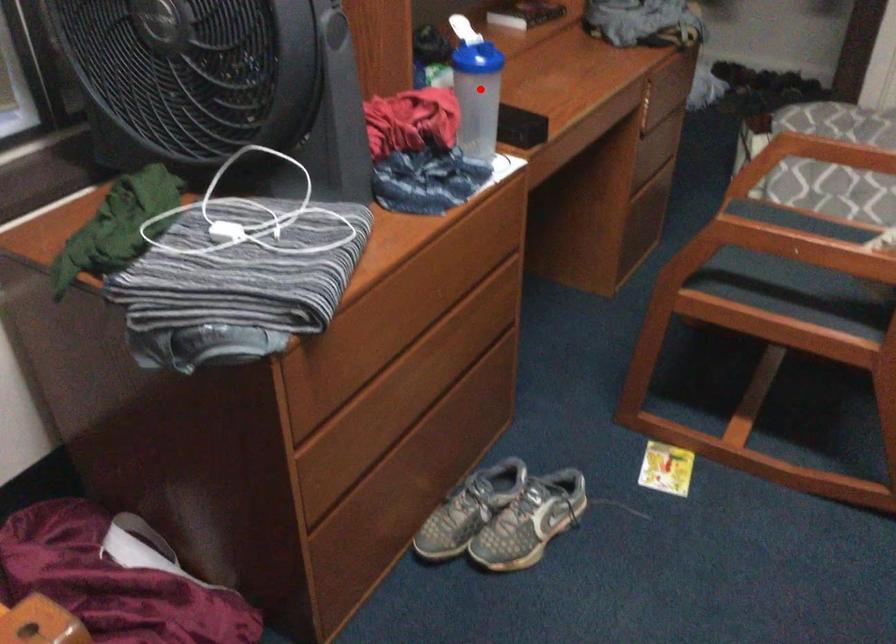
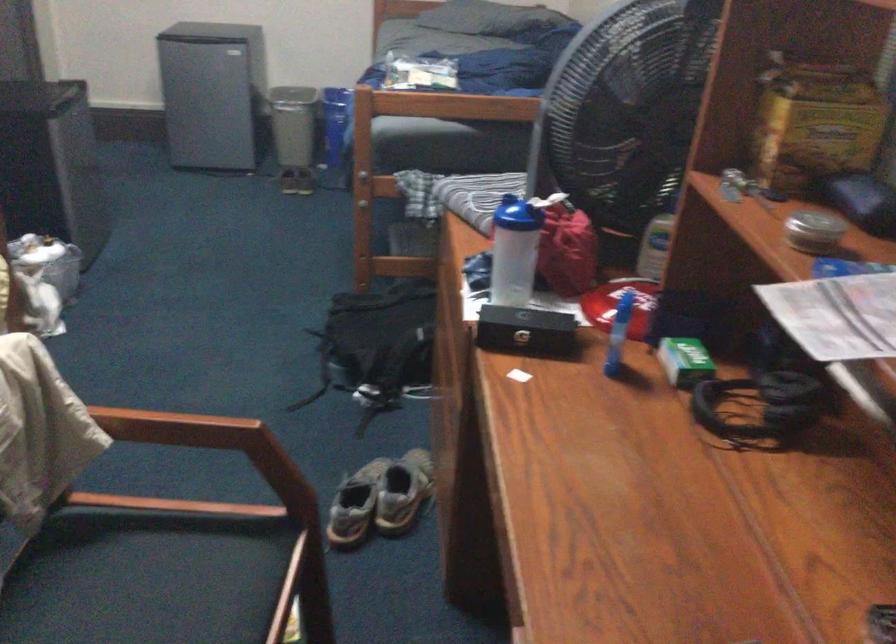
Find the pixel in the second image that matches the highlighted location in the first image.

(513, 251)